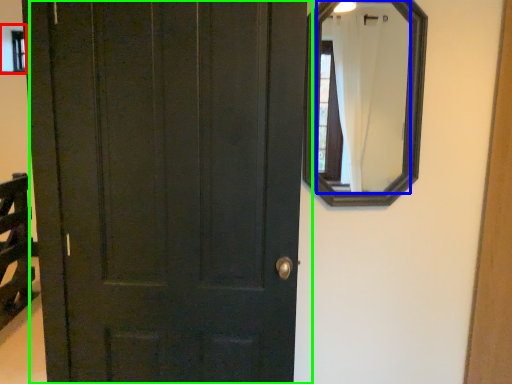
Question: Which is farther away from window (highlighted by a red box)? mirror (highlighted by a blue box) or door (highlighted by a green box)?

Choices:
 (A) mirror
 (B) door

Answer: (A)